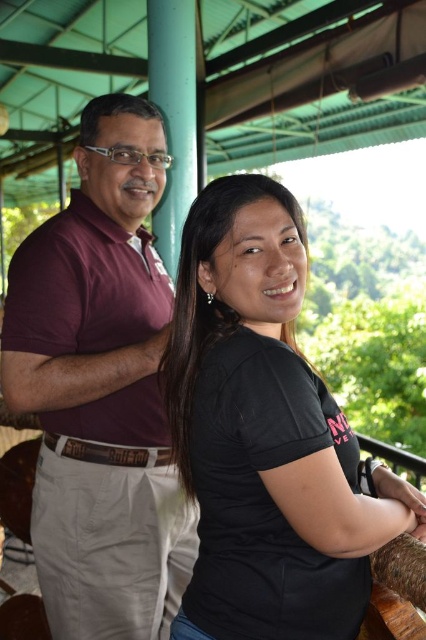
Between black matte shirt at center and maroon cotton shirt at left, which one is positioned lower?

maroon cotton shirt at left

Find the location of a particular element. The image size is (426, 640). black matte shirt at center is located at coordinates (265, 435).